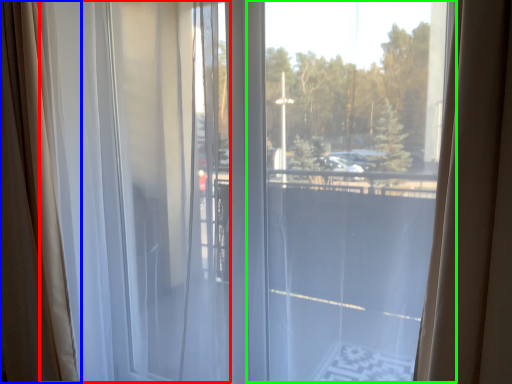
Question: Estimate the real-world distances between objects in this image. Which object is closer to curtain (highlighted by a red box), curtain (highlighted by a blue box) or glass window (highlighted by a green box)?

Choices:
 (A) curtain
 (B) glass window

Answer: (A)